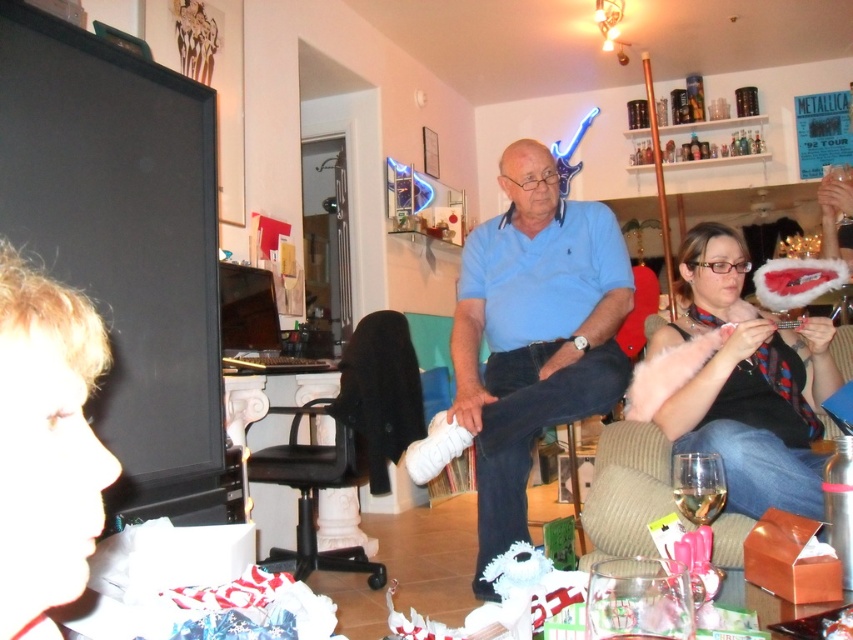
Consider the image. You are a photographer trying to capture a candid shot of the blue cotton shirt at center and the black leather chair at center. Since you want to ensure both are in focus, you need to know which object is larger. Which one is bigger?

The blue cotton shirt at center is bigger than the black leather chair at center, so you should focus on the blue cotton shirt at center as it requires more attention due to its size.

You are a delivery person who needs to place a small package on the nearest available surface. You have two options in the scene described. Which object, the matte black purse at lower right or the black leather chair at center, is wider and thus more suitable for placing the package?

The black leather chair at center has a greater width than the matte black purse at lower right, so it is more suitable for placing the package.